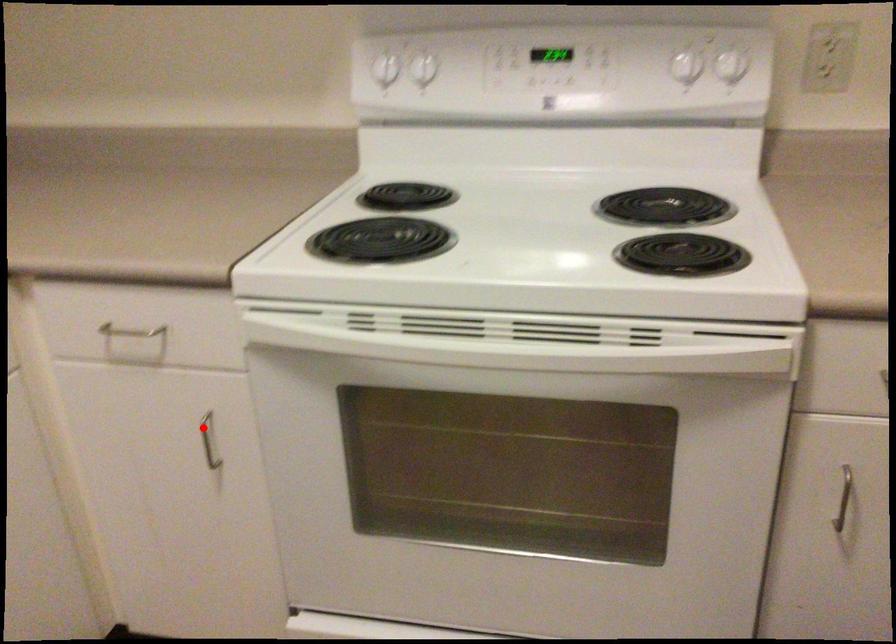
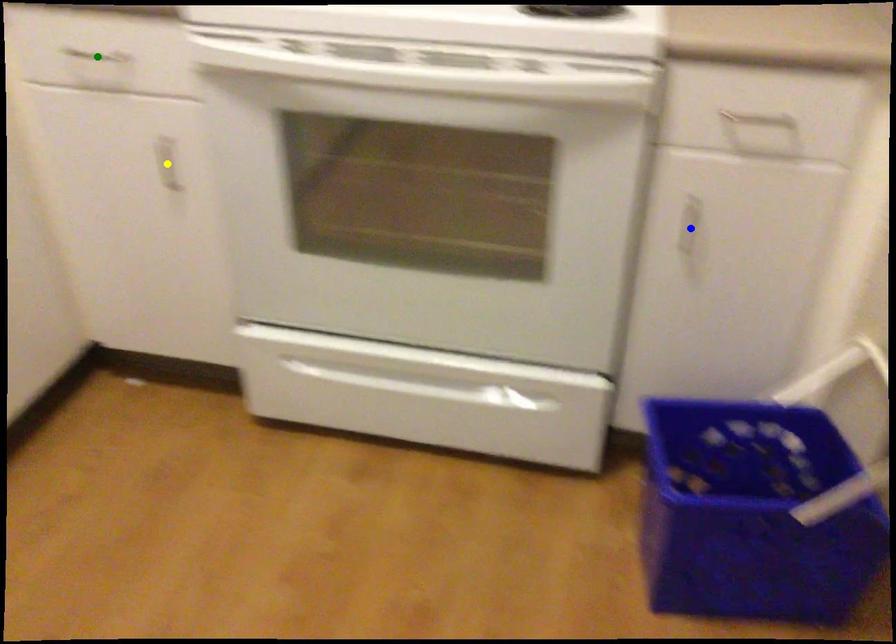
Question: I am providing you with two images of the same scene from different viewpoints. A red point is marked on the first image. You are given multiple points on the second image. Which spot in image 2 lines up with the point in image 1?

Choices:
 (A) blue point
 (B) yellow point
 (C) green point

Answer: (B)